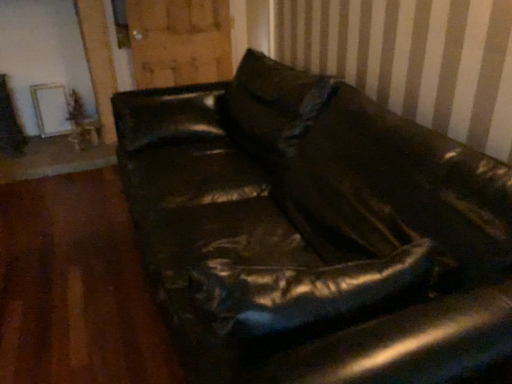
The width and height of the screenshot is (512, 384). Find the location of `wooden at upper center`. wooden at upper center is located at coordinates (179, 41).

Is leather couch at center inside or outside of wooden table at lower left?

leather couch at center lies outside wooden table at lower left.

Is leather couch at center touching wooden table at lower left?

No, leather couch at center is not beside wooden table at lower left.

Does leather couch at center have a smaller size compared to wooden table at lower left?

Actually, leather couch at center might be larger than wooden table at lower left.

Is leather couch at center to the right of wooden table at lower left from the viewer's perspective?

Yes.

Is leather couch at center turned away from wooden at upper center?

No, wooden at upper center is not at the back of leather couch at center.

From the image's perspective, is leather couch at center on wooden at upper center?

No, from the image's perspective, leather couch at center is not over wooden at upper center.

Is leather couch at center taller than wooden at upper center?

Indeed, leather couch at center has a greater height compared to wooden at upper center.

Would you say wooden table at lower left is outside wooden at upper center?

Absolutely, wooden table at lower left is external to wooden at upper center.

In terms of height, does wooden table at lower left look taller or shorter compared to wooden at upper center?

Considering their sizes, wooden table at lower left has less height than wooden at upper center.

Which point is more forward, (x=97, y=128) or (x=160, y=50)?

Positioned in front is point (x=160, y=50).

Which is more to the right, wooden at upper center or wooden table at lower left?

wooden at upper center is more to the right.

Is wooden at upper center not within wooden table at lower left?

wooden at upper center is positioned outside wooden table at lower left.

Considering the positions of points (227, 69) and (93, 122), is point (227, 69) closer to camera compared to point (93, 122)?

No, (227, 69) is behind (93, 122).

Who is taller, wooden table at lower left or leather couch at center?

leather couch at center is taller.

Could you tell me if wooden table at lower left is turned towards leather couch at center?

Yes, wooden table at lower left is aimed at leather couch at center.

Which object is closer to the camera taking this photo, wooden table at lower left or leather couch at center?

Positioned in front is leather couch at center.

Is leather couch at center located within wooden at upper center?

That's incorrect, leather couch at center is not inside wooden at upper center.

From the image's perspective, which one is positioned lower, wooden at upper center or leather couch at center?

leather couch at center.

From a real-world perspective, is wooden at upper center physically below leather couch at center?

Actually, wooden at upper center is physically above leather couch at center in the real world.

The width and height of the screenshot is (512, 384). In order to click on studio couch located on the right of wooden at upper center in this screenshot , I will do `click(315, 232)`.

What are the coordinates of `table that is behind the leather couch at center` in the screenshot? It's located at (85, 132).

Locate an element on the screen. Image resolution: width=512 pixels, height=384 pixels. barn door that appears above the leather couch at center (from a real-world perspective) is located at coordinates (179, 41).

Looking at the image, which one is located further to leather couch at center, wooden at upper center or wooden table at lower left?

wooden table at lower left.

Which object lies further to the anchor point wooden table at lower left, leather couch at center or wooden at upper center?

leather couch at center is positioned further to the anchor wooden table at lower left.

From the image, which object appears to be farther from wooden at upper center, wooden table at lower left or leather couch at center?

Based on the image, leather couch at center appears to be further to wooden at upper center.

When comparing their distances from wooden table at lower left, does wooden at upper center or leather couch at center seem further?

leather couch at center is further to wooden table at lower left.

When comparing their distances from wooden at upper center, does leather couch at center or wooden table at lower left seem closer?

wooden table at lower left.

From the picture: When comparing their distances from leather couch at center, does wooden table at lower left or wooden at upper center seem further?

Among the two, wooden table at lower left is located further to leather couch at center.

What are the coordinates of `barn door between leather couch at center and wooden table at lower left from front to back` in the screenshot? It's located at (179, 41).